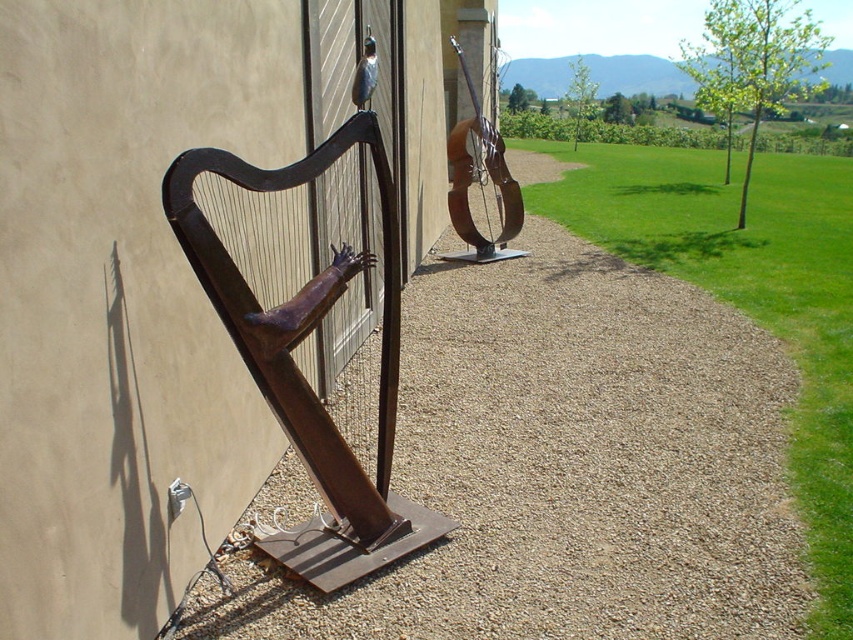
Question: Which object is the farthest from the brown gravel at center?

Choices:
 (A) rusty metal harp at left
 (B) rusty metal guitar at upper right

Answer: (A)

Question: Among these objects, which one is nearest to the camera?

Choices:
 (A) brown gravel at center
 (B) rusty metal harp at left

Answer: (B)

Question: From the image, what is the correct spatial relationship of brown gravel at center in relation to rusty metal harp at left?

Choices:
 (A) left
 (B) right

Answer: (B)

Question: Among these points, which one is farthest from the camera?

Choices:
 (A) (340, 564)
 (B) (502, 156)

Answer: (B)

Question: Does brown gravel at center appear on the left side of rusty metal harp at left?

Choices:
 (A) yes
 (B) no

Answer: (B)

Question: Considering the relative positions of brown gravel at center and rusty metal harp at left in the image provided, where is brown gravel at center located with respect to rusty metal harp at left?

Choices:
 (A) left
 (B) right

Answer: (B)